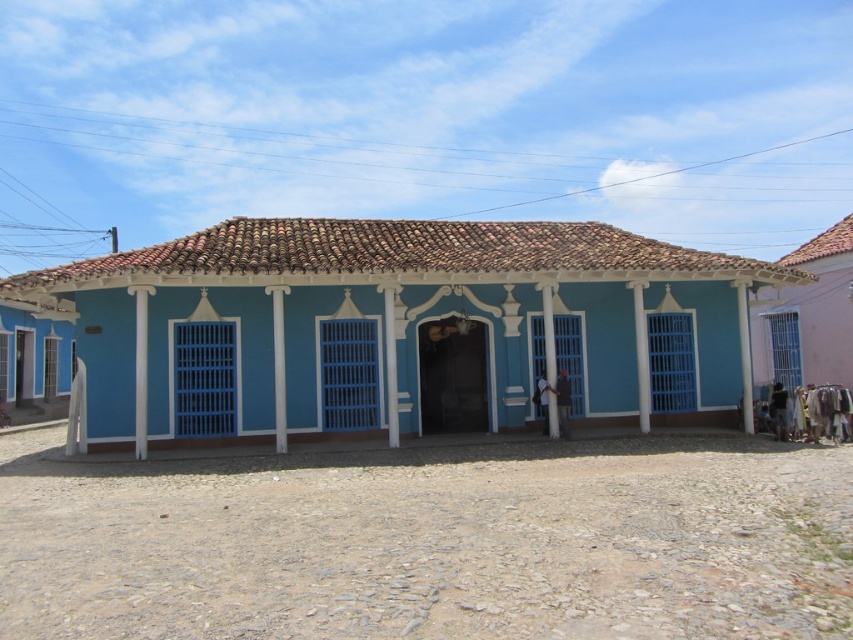
Question: Does blue painted wood house at center appear on the right side of pink fabric at right?

Choices:
 (A) no
 (B) yes

Answer: (A)

Question: Is blue painted wood house at center to the left of pink fabric at right from the viewer's perspective?

Choices:
 (A) no
 (B) yes

Answer: (B)

Question: Which point is closer to the camera?

Choices:
 (A) pos(196,252)
 (B) pos(846,342)

Answer: (A)

Question: Observing the image, what is the correct spatial positioning of blue painted wood house at center in reference to pink fabric at right?

Choices:
 (A) below
 (B) above

Answer: (A)

Question: Which point is closer to the camera taking this photo?

Choices:
 (A) (814, 380)
 (B) (375, 227)

Answer: (B)

Question: Which point is farther from the camera taking this photo?

Choices:
 (A) (215, 394)
 (B) (792, 362)

Answer: (B)